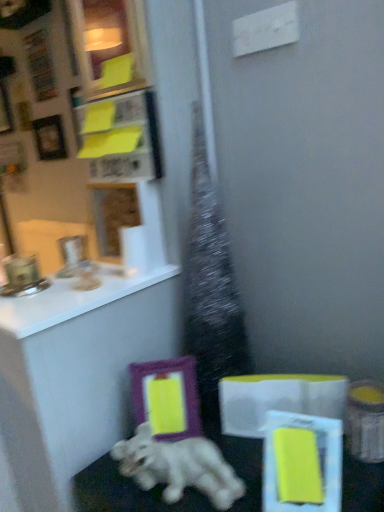
Question: Looking at their shapes, would you say purple matte picture frame at lower center, the third picture frame positioned from the back, is wider or thinner than matte purple picture frame at upper left, positioned as the 4th picture frame in front-to-back order?

Choices:
 (A) wide
 (B) thin

Answer: (A)

Question: In the image, is purple matte picture frame at lower center, the third picture frame positioned from the back, positioned in front of or behind matte purple picture frame at upper left, which appears as the 4th picture frame when ordered from the bottom?

Choices:
 (A) behind
 (B) front

Answer: (B)

Question: Estimate the real-world distances between objects in this image. Which object is closer to the purple matte picture frame at lower center, the third picture frame positioned from the back?

Choices:
 (A) white glossy countertop at upper left
 (B) white glossy elephant at lower center
 (C) white glossy dog at lower center
 (D) matte purple picture frame at upper left, the first picture frame when ordered from top to bottom
 (E) yellow paper at upper left

Answer: (C)

Question: Which is farther from the yellow paper at upper left?

Choices:
 (A) wooden photo frame at upper left, marked as the third picture frame in a front-to-back arrangement
 (B) white glossy elephant at lower center
 (C) matte yellow picture frame at upper left, the 2th picture frame in the right-to-left sequence
 (D) purple matte picture frame at lower center, which appears as the first picture frame when ordered from the bottom
 (E) matte purple picture frame at upper left, which is the fourth picture frame in right-to-left order

Answer: (E)